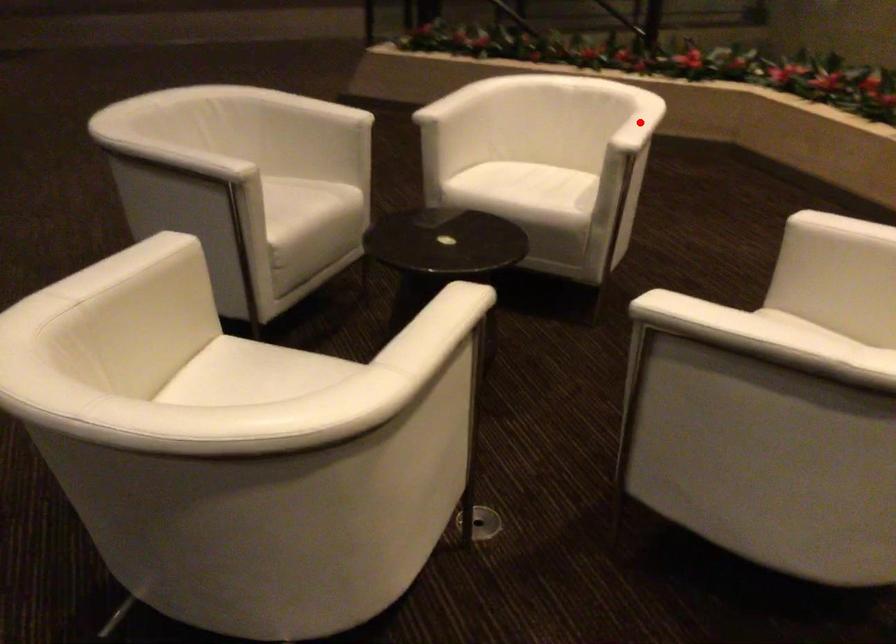
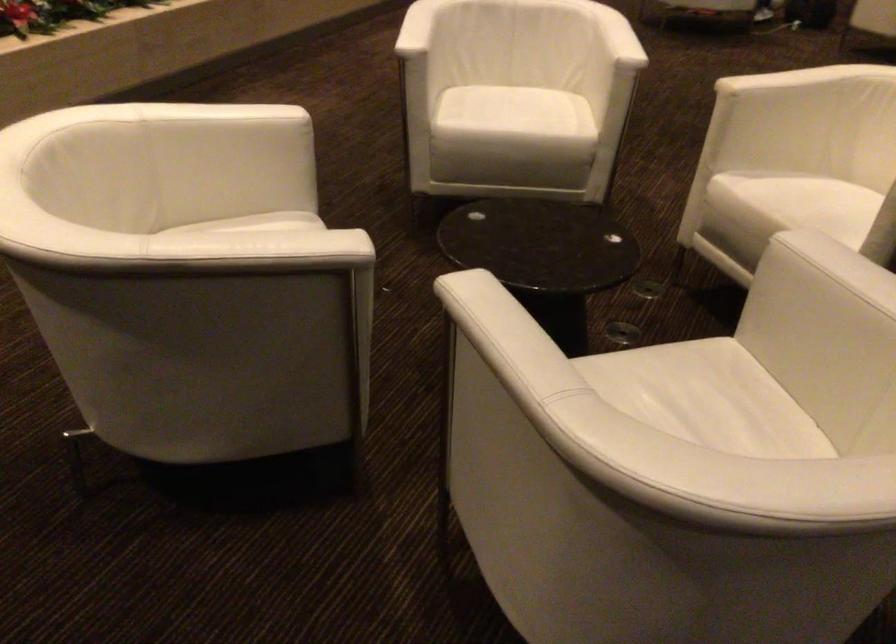
Question: I am providing you with two images of the same scene from different viewpoints. A red point is marked on the first image. Can you still see the location of the red point in image 2?

Choices:
 (A) Yes
 (B) No

Answer: (B)